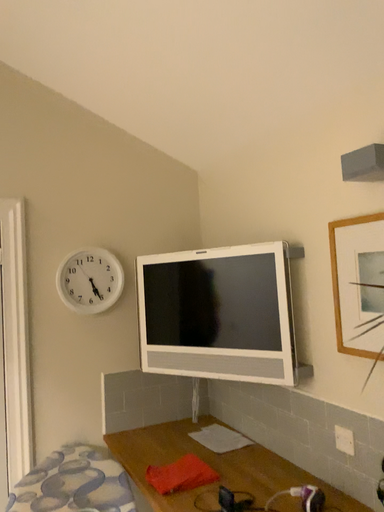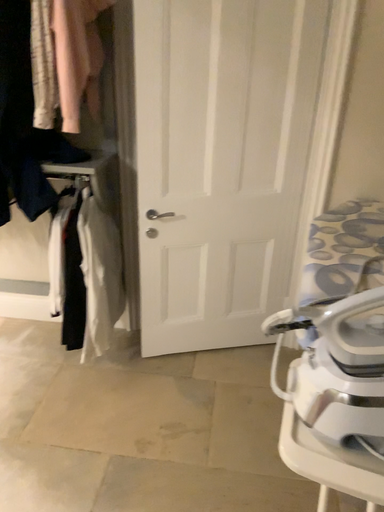
Question: How did the camera likely rotate when shooting the video?

Choices:
 (A) rotated downward
 (B) rotated upward

Answer: (A)